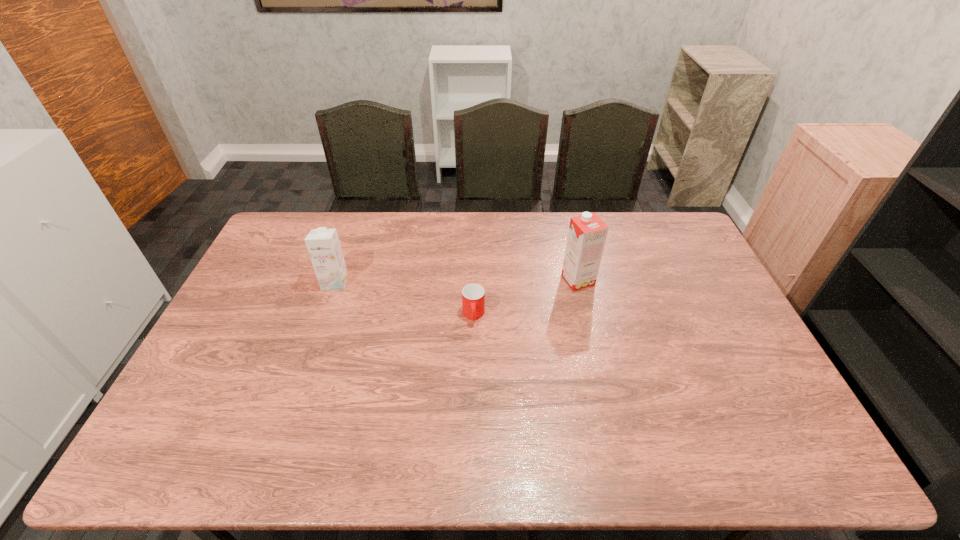
What are the coordinates of `free location at the near edge of the desktop` in the screenshot? It's located at (272, 447).

Identify the location of vacant space at the left edge. (266, 335).

In the image, there is a desktop. Where is `vacant space at the right edge`? The width and height of the screenshot is (960, 540). vacant space at the right edge is located at coordinates (738, 370).

In the image, there is a desktop. Identify the location of vacant space at the far left corner. The height and width of the screenshot is (540, 960). [305, 238].

In the image, there is a desktop. Find the location of `free space at the far right corner`. free space at the far right corner is located at coordinates (665, 226).

You are a GUI agent. You are given a task and a screenshot of the screen. Output one action in this format:
    pyautogui.click(x=<x>, y=<y>)
    Task: Click on the vacant space in between the leftmost object and the shortest object
    This screenshot has width=960, height=540.
    Given the screenshot: What is the action you would take?
    pyautogui.click(x=404, y=299)

You are a GUI agent. You are given a task and a screenshot of the screen. Output one action in this format:
    pyautogui.click(x=<x>, y=<y>)
    Task: Click on the vacant area that lies between the tallest object and the shortest object
    The image size is (960, 540).
    Given the screenshot: What is the action you would take?
    pyautogui.click(x=526, y=298)

You are a GUI agent. You are given a task and a screenshot of the screen. Output one action in this format:
    pyautogui.click(x=<x>, y=<y>)
    Task: Click on the empty space that is in between the shortest object and the second shortest object
    
    Given the screenshot: What is the action you would take?
    pyautogui.click(x=404, y=299)

The image size is (960, 540). In order to click on free space between the shorter carton and the cup in this screenshot , I will do `click(404, 299)`.

Where is `vacant region between the shortest object and the left carton`? Image resolution: width=960 pixels, height=540 pixels. vacant region between the shortest object and the left carton is located at coordinates (404, 299).